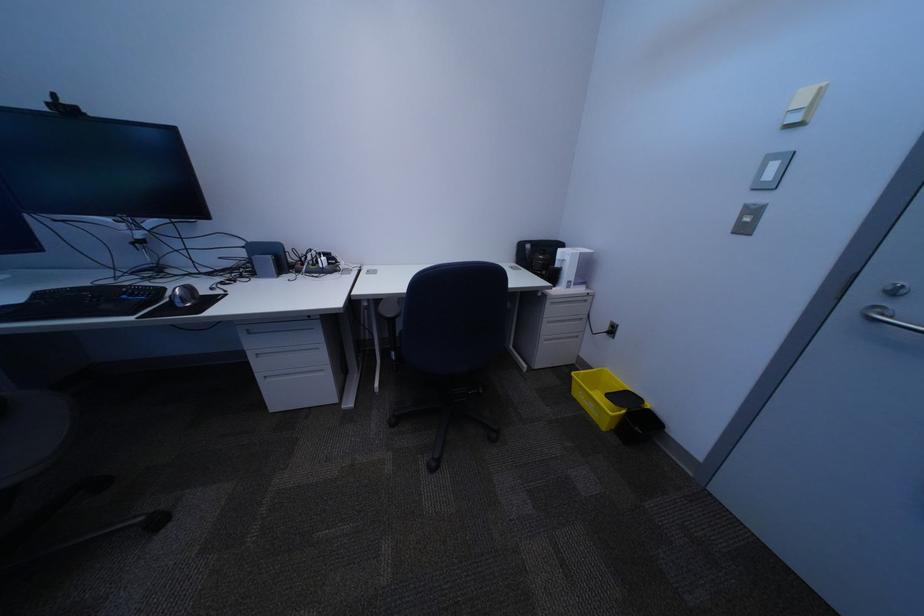
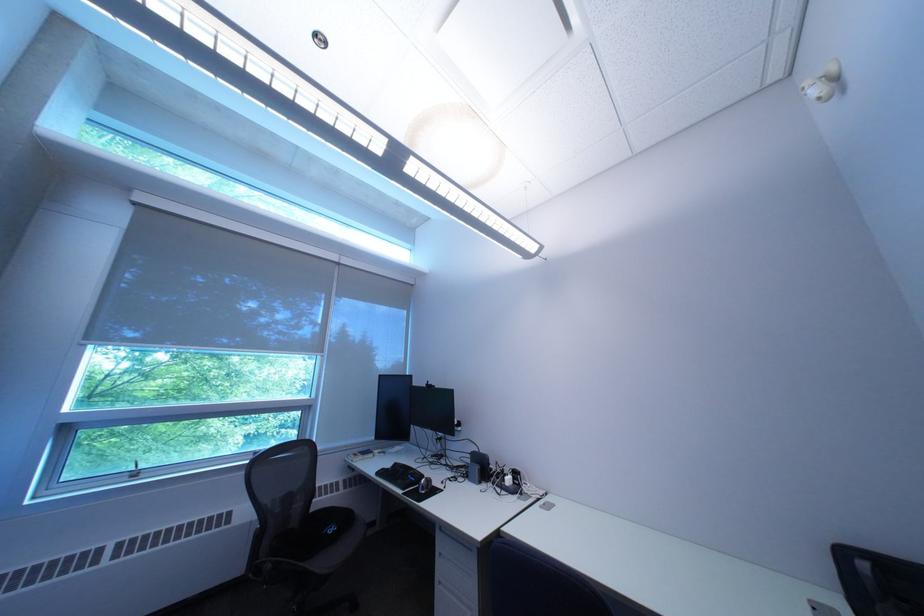
Where in the second image is the point corresponding to the point at 152,320 from the first image?

(418, 495)